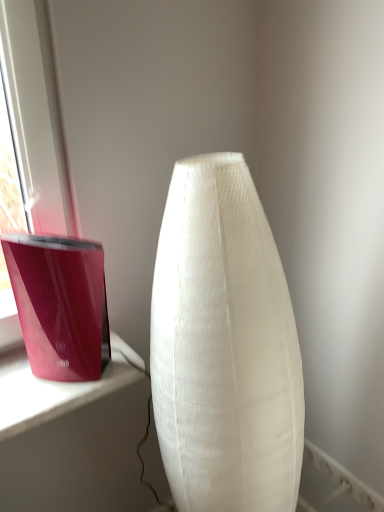
Question: Based on their positions, is white fabric lamp at center located to the left or right of glossy plastic candle holder at left?

Choices:
 (A) right
 (B) left

Answer: (A)

Question: Do you think white fabric lamp at center is within glossy plastic candle holder at left, or outside of it?

Choices:
 (A) inside
 (B) outside

Answer: (B)

Question: Is point (213, 300) positioned closer to the camera than point (71, 350)?

Choices:
 (A) closer
 (B) farther

Answer: (A)

Question: In terms of width, does glossy plastic candle holder at left look wider or thinner when compared to white fabric lamp at center?

Choices:
 (A) wide
 (B) thin

Answer: (B)

Question: Is glossy plastic candle holder at left taller or shorter than white fabric lamp at center?

Choices:
 (A) tall
 (B) short

Answer: (B)

Question: Would you say glossy plastic candle holder at left is to the left or to the right of white fabric lamp at center in the picture?

Choices:
 (A) left
 (B) right

Answer: (A)

Question: In terms of size, does glossy plastic candle holder at left appear bigger or smaller than white fabric lamp at center?

Choices:
 (A) big
 (B) small

Answer: (B)